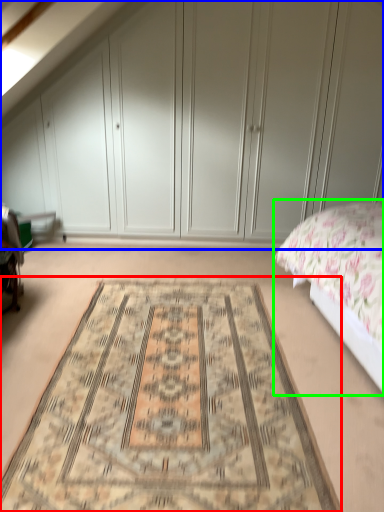
Question: Considering the real-world distances, which object is farthest from mat (highlighted by a red box)? dresser (highlighted by a blue box) or bed (highlighted by a green box)?

Choices:
 (A) dresser
 (B) bed

Answer: (A)